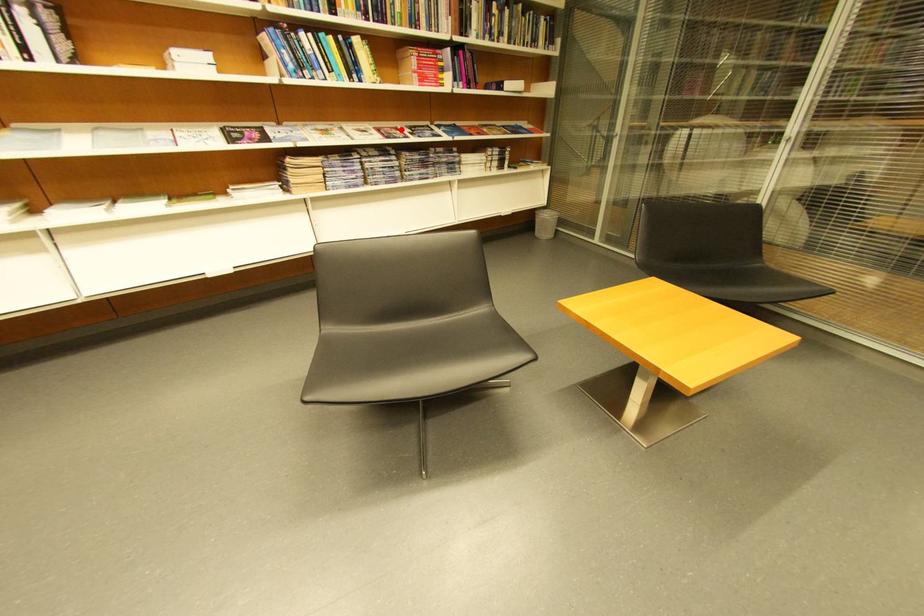
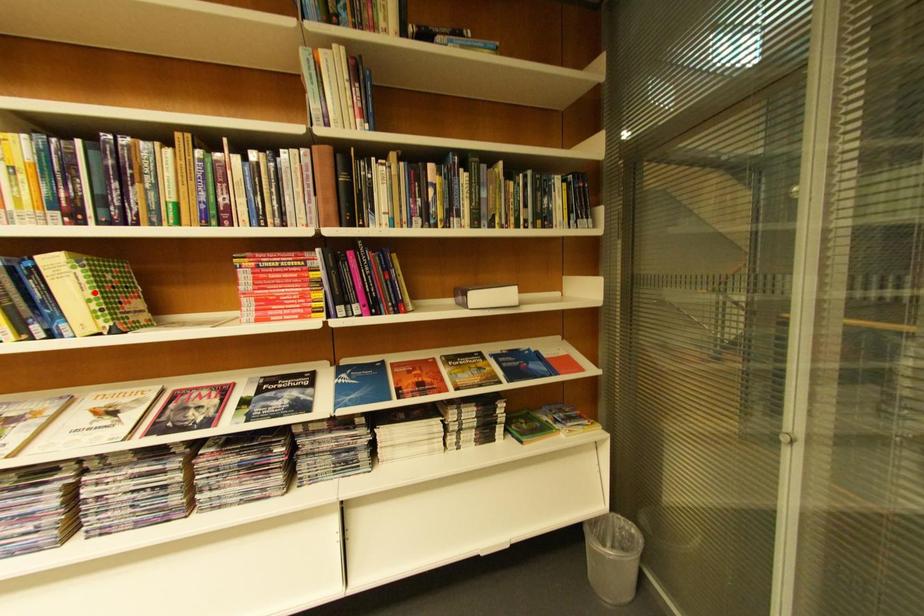
I am providing you with two images of the same scene from different viewpoints. A red point is marked on the first image and another point is marked on the second image. Are the points marked in image1 and image2 representing the same 3D position?

No